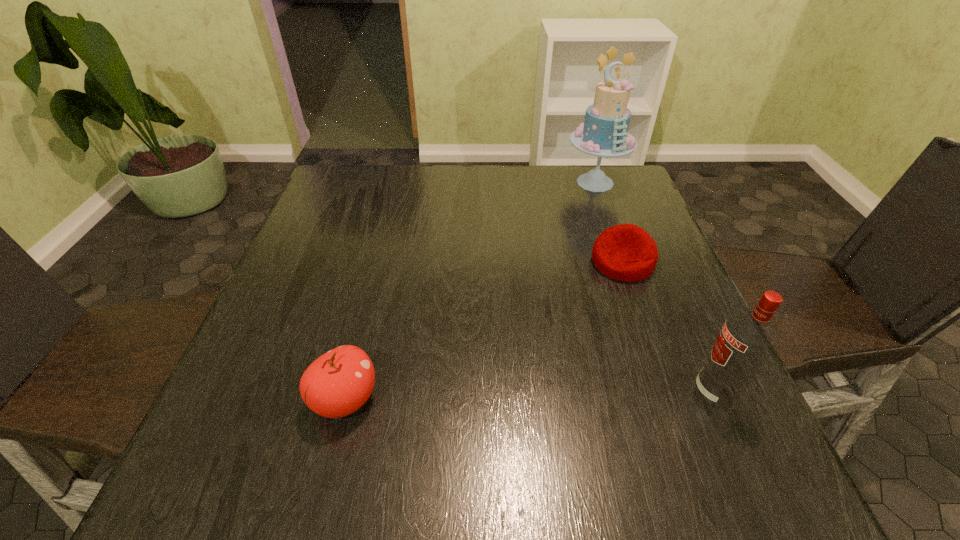
The height and width of the screenshot is (540, 960). I want to click on free spot on the desktop that is between the third tallest object and the second tallest object and is positioned on the seat area of the shortest object, so click(564, 395).

Image resolution: width=960 pixels, height=540 pixels. Identify the location of vacant spot on the desktop that is between the apple and the third shortest object and is positioned with a ladder on the side of the tallest object. tap(574, 395).